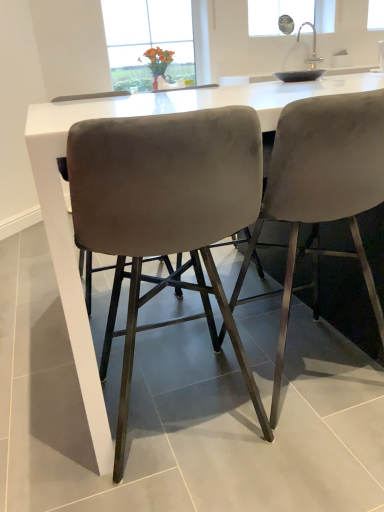
Question: Visually, is velvet grey bar stool at center, which ranks as the first chair in right-to-left order, positioned to the left or to the right of velvet grey chair at center, the 1th chair positioned from the left?

Choices:
 (A) right
 (B) left

Answer: (A)

Question: Is point (286, 308) closer or farther from the camera than point (155, 165)?

Choices:
 (A) closer
 (B) farther

Answer: (B)

Question: Considering the positions of velvet grey bar stool at center, which ranks as the first chair in right-to-left order, and velvet grey chair at center, the second chair from the right, in the image, is velvet grey bar stool at center, which ranks as the first chair in right-to-left order, bigger or smaller than velvet grey chair at center, the second chair from the right,?

Choices:
 (A) small
 (B) big

Answer: (B)

Question: Does point (196, 136) appear closer or farther from the camera than point (332, 162)?

Choices:
 (A) closer
 (B) farther

Answer: (A)

Question: Is velvet grey chair at center, the second chair from the right, situated inside velvet grey bar stool at center, which ranks as the first chair in right-to-left order, or outside?

Choices:
 (A) inside
 (B) outside

Answer: (B)

Question: Based on their sizes in the image, would you say velvet grey chair at center, the 1th chair positioned from the left, is bigger or smaller than velvet grey bar stool at center, which ranks as the first chair in right-to-left order?

Choices:
 (A) big
 (B) small

Answer: (B)

Question: Considering the relative positions of velvet grey chair at center, the second chair from the right, and velvet grey bar stool at center, positioned as the 2th chair in left-to-right order, in the image provided, is velvet grey chair at center, the second chair from the right, to the left or to the right of velvet grey bar stool at center, positioned as the 2th chair in left-to-right order,?

Choices:
 (A) left
 (B) right

Answer: (A)